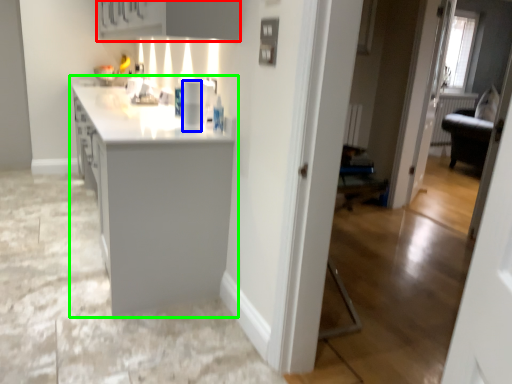
Question: Which is nearer to the cabinetry (highlighted by a red box)? appliance (highlighted by a blue box) or countertop (highlighted by a green box).

Choices:
 (A) appliance
 (B) countertop

Answer: (A)